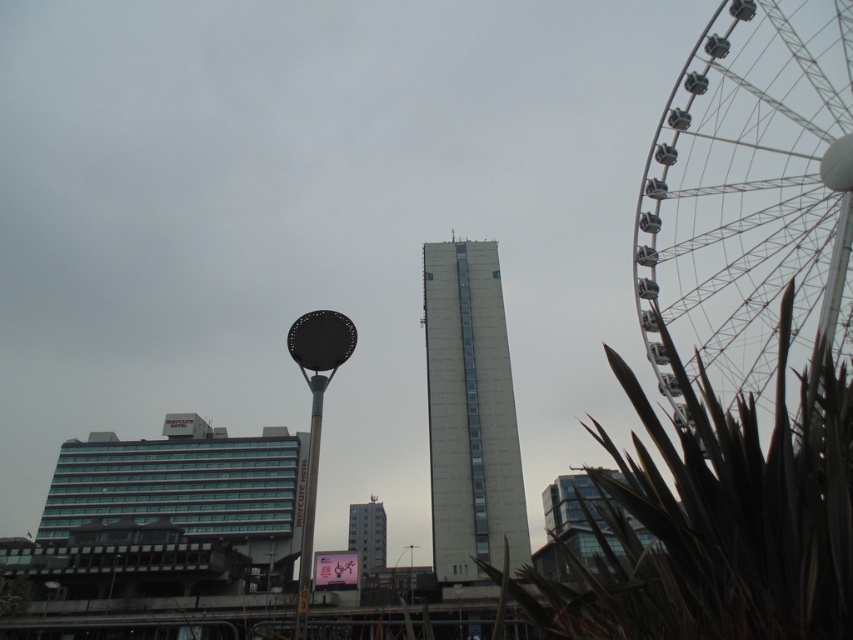
Is point (444, 332) positioned in front of point (358, 509)?

Yes, it is.

Is white smooth building at center above white glass building at center?

Correct, white smooth building at center is located above white glass building at center.

Is point (514, 440) less distant than point (361, 538)?

Yes, it is in front of point (361, 538).

Find the location of a particular element. white smooth building at center is located at coordinates (469, 412).

Is metallic gray ferris wheel at right taller than white glass building at center?

Correct, metallic gray ferris wheel at right is much taller as white glass building at center.

Between metallic gray ferris wheel at right and white glass building at center, which one is positioned higher?

metallic gray ferris wheel at right is above.

Image resolution: width=853 pixels, height=640 pixels. Describe the element at coordinates (747, 196) in the screenshot. I see `metallic gray ferris wheel at right` at that location.

Locate an element on the screen. The height and width of the screenshot is (640, 853). metallic gray ferris wheel at right is located at coordinates (747, 196).

In the scene shown: Is white glossy pole at center bigger than white glass building at center?

Indeed, white glossy pole at center has a larger size compared to white glass building at center.

Can you confirm if white glossy pole at center is positioned above white glass building at center?

Yes, white glossy pole at center is above white glass building at center.

The image size is (853, 640). Describe the element at coordinates (309, 502) in the screenshot. I see `white glossy pole at center` at that location.

Where is `white glossy pole at center`? The image size is (853, 640). white glossy pole at center is located at coordinates (309, 502).